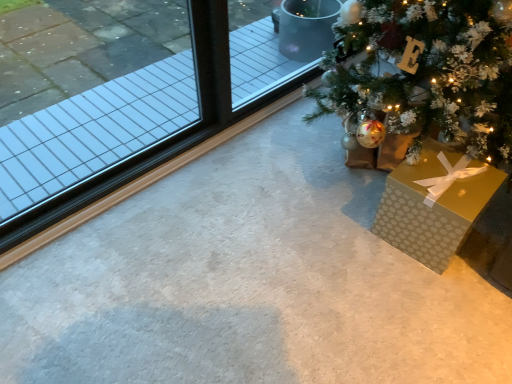
Question: Is gold paper gift at lower right situated inside clear glass window at left or outside?

Choices:
 (A) outside
 (B) inside

Answer: (A)

Question: Does point (458, 206) appear closer or farther from the camera than point (176, 150)?

Choices:
 (A) closer
 (B) farther

Answer: (A)

Question: Is gold paper gift at lower right taller or shorter than clear glass window at left?

Choices:
 (A) tall
 (B) short

Answer: (B)

Question: Which is correct: clear glass window at left is inside gold paper gift at lower right, or outside of it?

Choices:
 (A) inside
 (B) outside

Answer: (B)

Question: Looking at their shapes, would you say clear glass window at left is wider or thinner than gold paper gift at lower right?

Choices:
 (A) wide
 (B) thin

Answer: (B)

Question: Is clear glass window at left in front of or behind gold paper gift at lower right in the image?

Choices:
 (A) front
 (B) behind

Answer: (A)

Question: From the image's perspective, is clear glass window at left located above or below gold paper gift at lower right?

Choices:
 (A) above
 (B) below

Answer: (A)